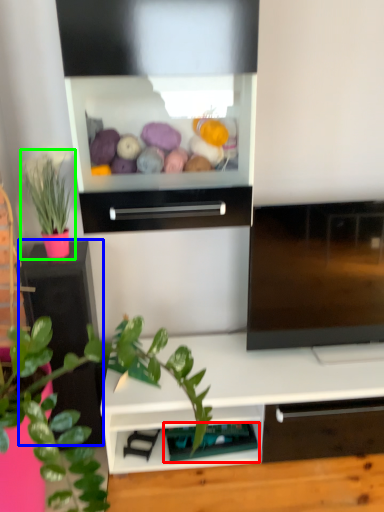
Question: Considering the real-world distances, which object is closest to shelf (highlighted by a red box)? table (highlighted by a blue box) or houseplant (highlighted by a green box).

Choices:
 (A) table
 (B) houseplant

Answer: (A)